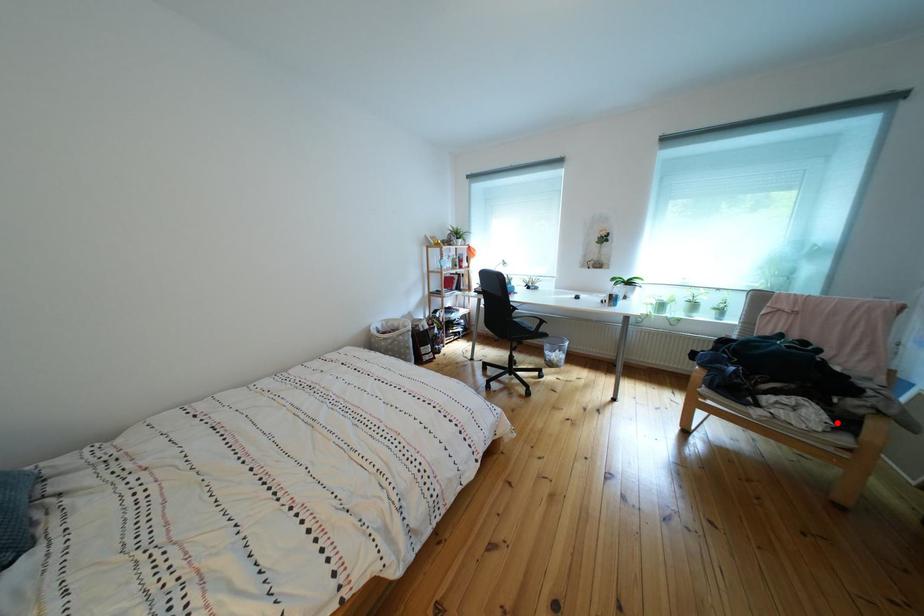
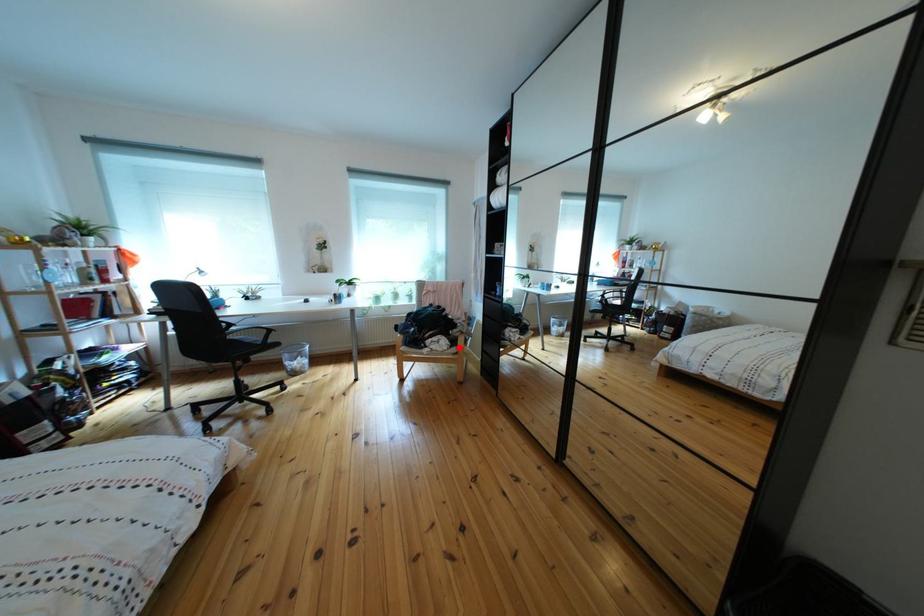
I am providing you with two images of the same scene from different viewpoints. A red point is marked on the first image and another point is marked on the second image. Does the point marked in image1 correspond to the same location as the one in image2?

Yes